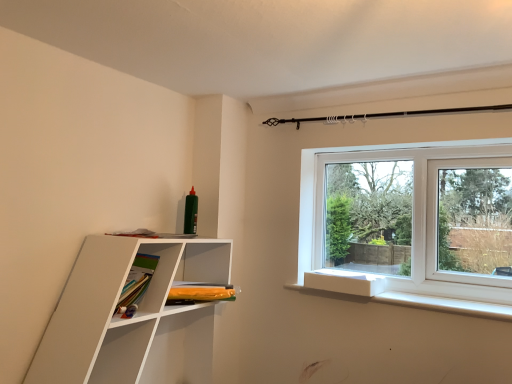
The height and width of the screenshot is (384, 512). Describe the element at coordinates (133, 317) in the screenshot. I see `white matte shelf at left` at that location.

What are the coordinates of `white matte shelf at left` in the screenshot? It's located at (133, 317).

This screenshot has height=384, width=512. Identify the location of orange matte bookshelf at lower left. (200, 292).

Image resolution: width=512 pixels, height=384 pixels. What do you see at coordinates (200, 292) in the screenshot?
I see `orange matte bookshelf at lower left` at bounding box center [200, 292].

Find the location of a particular element. The width and height of the screenshot is (512, 384). white matte shelf at left is located at coordinates (133, 317).

Is orange matte bookshelf at lower left to the left of white matte shelf at left from the viewer's perspective?

No, orange matte bookshelf at lower left is not to the left of white matte shelf at left.

In the scene shown: Which object is further away from the camera taking this photo, orange matte bookshelf at lower left or white matte shelf at left?

orange matte bookshelf at lower left is more distant.

Does point (197, 298) come behind point (101, 239)?

That is True.

From the image's perspective, is orange matte bookshelf at lower left positioned above or below white matte shelf at left?

Based on their image positions, orange matte bookshelf at lower left is located above white matte shelf at left.

From the picture: From a real-world perspective, which object stands above the other?

From a 3D spatial view, orange matte bookshelf at lower left is above.

Is orange matte bookshelf at lower left wider than white matte shelf at left?

No, orange matte bookshelf at lower left is not wider than white matte shelf at left.

Does orange matte bookshelf at lower left have a greater height compared to white matte shelf at left?

Incorrect, the height of orange matte bookshelf at lower left is not larger of that of white matte shelf at left.

Considering the sizes of objects orange matte bookshelf at lower left and white matte shelf at left in the image provided, who is smaller, orange matte bookshelf at lower left or white matte shelf at left?

orange matte bookshelf at lower left is smaller.

Can we say orange matte bookshelf at lower left lies outside white matte shelf at left?

That's incorrect, orange matte bookshelf at lower left is not completely outside white matte shelf at left.

From the picture: Is orange matte bookshelf at lower left not near white matte shelf at left?

No, there isn't a large distance between orange matte bookshelf at lower left and white matte shelf at left.

Is orange matte bookshelf at lower left turned away from white matte shelf at left?

Absolutely, orange matte bookshelf at lower left is directed away from white matte shelf at left.

You are a GUI agent. You are given a task and a screenshot of the screen. Output one action in this format:
    pyautogui.click(x=<x>, y=<y>)
    Task: Click on the shelf in front of the orange matte bookshelf at lower left
    
    Given the screenshot: What is the action you would take?
    point(133,317)

Can you confirm if white matte shelf at left is positioned to the right of orange matte bookshelf at lower left?

In fact, white matte shelf at left is to the left of orange matte bookshelf at lower left.

Is white matte shelf at left behind orange matte bookshelf at lower left?

No.

Is point (197, 247) farther from viewer compared to point (173, 283)?

Yes, point (197, 247) is farther from viewer.

From the image's perspective, which is below, white matte shelf at left or orange matte bookshelf at lower left?

From the image's view, white matte shelf at left is below.

From a real-world perspective, which object stands above the other?

orange matte bookshelf at lower left, from a real-world perspective.

Can you confirm if white matte shelf at left is thinner than orange matte bookshelf at lower left?

Incorrect, the width of white matte shelf at left is not less than that of orange matte bookshelf at lower left.

Is white matte shelf at left taller than orange matte bookshelf at lower left?

Yes, white matte shelf at left is taller than orange matte bookshelf at lower left.

Does white matte shelf at left have a smaller size compared to orange matte bookshelf at lower left?

No, white matte shelf at left is not smaller than orange matte bookshelf at lower left.

Is orange matte bookshelf at lower left surrounded by white matte shelf at left?

Yes, orange matte bookshelf at lower left is inside white matte shelf at left.

Is white matte shelf at left beside orange matte bookshelf at lower left?

They are not placed beside each other.

Is white matte shelf at left facing towards orange matte bookshelf at lower left?

Yes, white matte shelf at left faces towards orange matte bookshelf at lower left.

How much distance is there between white matte shelf at left and orange matte bookshelf at lower left?

A distance of 25.92 centimeters exists between white matte shelf at left and orange matte bookshelf at lower left.

At what (x,y) coordinates should I click in order to perform the action: click on shelf located on the left of orange matte bookshelf at lower left. Please return your answer as a coordinate pair (x, y). Looking at the image, I should click on (133, 317).

Where is `book above the white matte shelf at left (from a real-world perspective)`? This screenshot has height=384, width=512. book above the white matte shelf at left (from a real-world perspective) is located at coordinates (200, 292).

The width and height of the screenshot is (512, 384). In the image, there is a orange matte bookshelf at lower left. In order to click on shelf below it (from a real-world perspective) in this screenshot , I will do `click(133, 317)`.